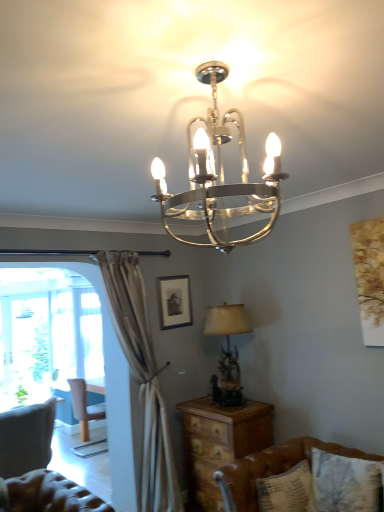
Question: Is brown leather couch at lower right oriented towards light brown wooden chair at left?

Choices:
 (A) yes
 (B) no

Answer: (B)

Question: Does brown leather couch at lower right have a greater height compared to light brown wooden chair at left?

Choices:
 (A) yes
 (B) no

Answer: (B)

Question: Is the depth of brown leather couch at lower right less than that of light brown wooden chair at left?

Choices:
 (A) yes
 (B) no

Answer: (A)

Question: Is brown leather couch at lower right facing away from light brown wooden chair at left?

Choices:
 (A) no
 (B) yes

Answer: (A)

Question: Is light brown wooden chair at left inside brown leather couch at lower right?

Choices:
 (A) no
 (B) yes

Answer: (A)

Question: Is matte beige lampshade at right, the 2th lamp positioned from the front, to the left or to the right of brown leather couch at lower right in the image?

Choices:
 (A) left
 (B) right

Answer: (A)

Question: Is matte beige lampshade at right, which is the 2th lamp from top to bottom, taller or shorter than brown leather couch at lower right?

Choices:
 (A) short
 (B) tall

Answer: (B)

Question: Is point (210, 320) closer or farther from the camera than point (233, 477)?

Choices:
 (A) farther
 (B) closer

Answer: (A)

Question: From the image's perspective, relative to brown leather couch at lower right, is matte beige lampshade at right, which is the 2th lamp from top to bottom, above or below?

Choices:
 (A) below
 (B) above

Answer: (B)

Question: From a real-world perspective, is light brown wooden chair at left positioned above or below brown leather couch at lower right?

Choices:
 (A) above
 (B) below

Answer: (B)

Question: Visually, is light brown wooden chair at left positioned to the left or to the right of brown leather couch at lower right?

Choices:
 (A) right
 (B) left

Answer: (B)

Question: From the image's perspective, is light brown wooden chair at left positioned above or below brown leather couch at lower right?

Choices:
 (A) below
 (B) above

Answer: (A)

Question: Considering their positions, is light brown wooden chair at left located in front of or behind brown leather couch at lower right?

Choices:
 (A) front
 (B) behind

Answer: (B)

Question: Relative to patterned fabric pillow at lower right, is light brown wooden chair at left in front or behind?

Choices:
 (A) behind
 (B) front

Answer: (A)

Question: Considering the positions of light brown wooden chair at left and patterned fabric pillow at lower right in the image, is light brown wooden chair at left bigger or smaller than patterned fabric pillow at lower right?

Choices:
 (A) big
 (B) small

Answer: (A)